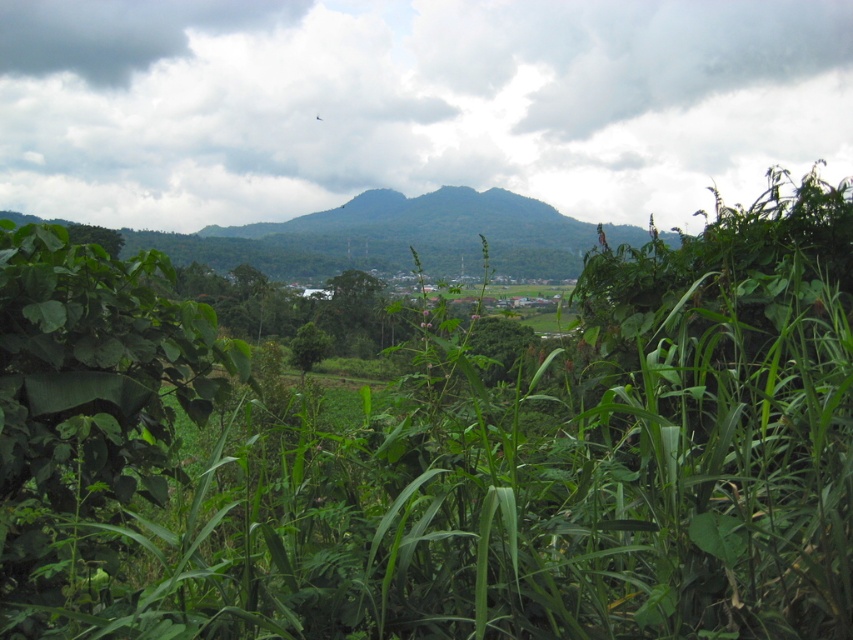
You are an explorer navigating through this landscape. You need to determine the vertical relationship between the green leafy jungle at center and the cloudy sky at upper center. Which one is positioned higher in the scene?

The cloudy sky at upper center is positioned higher than the green leafy jungle at center in the scene.

You are an explorer in this landscape. You notice the green leafy jungle at center and the cloudy sky at upper center. Which of these two elements takes up less space in the image?

The green leafy jungle at center is smaller than cloudy sky at upper center, so it takes up less space in the image.